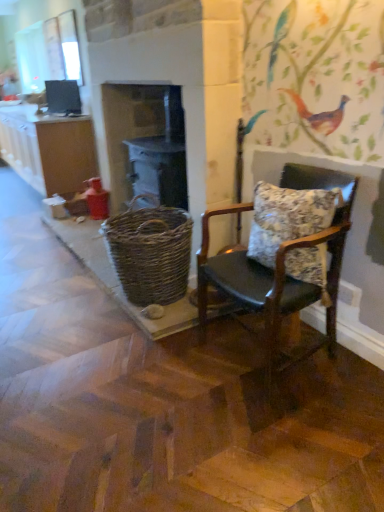
Question: From the image's perspective, is floral fabric pillow at right beneath woven brown basket at center?

Choices:
 (A) yes
 (B) no

Answer: (B)

Question: Is floral fabric pillow at right shorter than woven brown basket at center?

Choices:
 (A) no
 (B) yes

Answer: (B)

Question: Considering the relative sizes of floral fabric pillow at right and woven brown basket at center in the image provided, is floral fabric pillow at right smaller than woven brown basket at center?

Choices:
 (A) yes
 (B) no

Answer: (A)

Question: Is floral fabric pillow at right positioned with its back to woven brown basket at center?

Choices:
 (A) no
 (B) yes

Answer: (A)

Question: From the image's perspective, is floral fabric pillow at right above woven brown basket at center?

Choices:
 (A) yes
 (B) no

Answer: (A)

Question: Relative to woven wood basket at center, is matte brown cabinet at left in front or behind?

Choices:
 (A) front
 (B) behind

Answer: (B)

Question: Looking at their shapes, would you say matte brown cabinet at left is wider or thinner than woven wood basket at center?

Choices:
 (A) wide
 (B) thin

Answer: (A)

Question: From the image's perspective, is matte brown cabinet at left above or below woven wood basket at center?

Choices:
 (A) above
 (B) below

Answer: (A)

Question: Would you say matte brown cabinet at left is to the left or to the right of woven wood basket at center in the picture?

Choices:
 (A) right
 (B) left

Answer: (B)

Question: From the image's perspective, is woven brown basket at center above or below floral fabric pillow at right?

Choices:
 (A) below
 (B) above

Answer: (A)

Question: Is point (173, 228) closer or farther from the camera than point (258, 236)?

Choices:
 (A) farther
 (B) closer

Answer: (A)

Question: Do you think woven brown basket at center is within floral fabric pillow at right, or outside of it?

Choices:
 (A) inside
 (B) outside

Answer: (B)

Question: From a real-world perspective, relative to floral fabric pillow at right, is woven brown basket at center vertically above or below?

Choices:
 (A) above
 (B) below

Answer: (B)

Question: Considering the positions of leather cushioned chair at right and woven brown basket at center in the image, is leather cushioned chair at right taller or shorter than woven brown basket at center?

Choices:
 (A) short
 (B) tall

Answer: (B)

Question: From a real-world perspective, is leather cushioned chair at right above or below woven brown basket at center?

Choices:
 (A) below
 (B) above

Answer: (B)